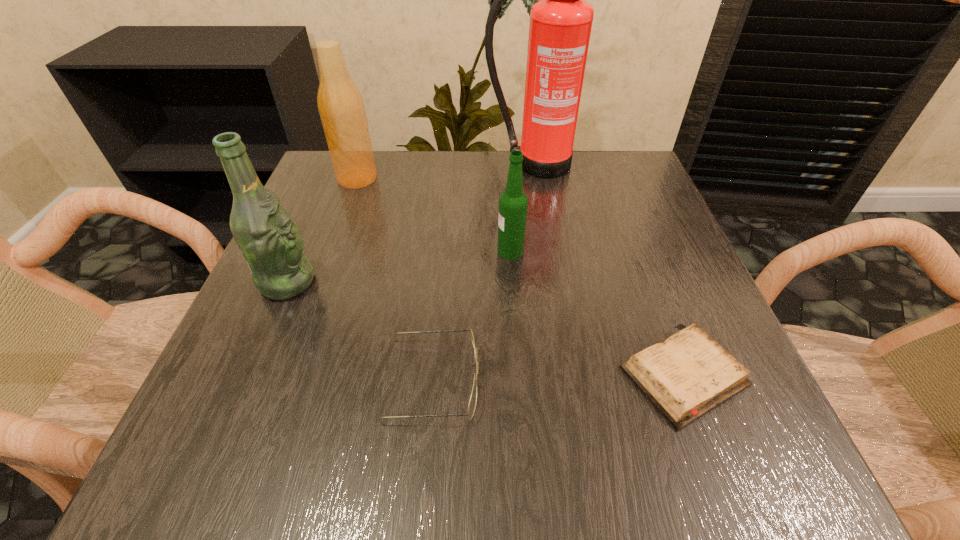
Locate an element on the screen. The width and height of the screenshot is (960, 540). fire extinguisher positioned at the right edge is located at coordinates (560, 26).

Find the location of a particular element. diary positioned at the right edge is located at coordinates (688, 374).

I want to click on object situated at the far left corner, so click(x=341, y=107).

At what (x,y) coordinates should I click in order to perform the action: click on object present at the far right corner. Please return your answer as a coordinate pair (x, y). The width and height of the screenshot is (960, 540). Looking at the image, I should click on (560, 26).

Identify the location of object that is at the near right corner. (688, 374).

Find the location of a particular element. The image size is (960, 540). vacant space at the far edge of the desktop is located at coordinates (462, 171).

Where is `free spot at the near edge of the desktop`? The image size is (960, 540). free spot at the near edge of the desktop is located at coordinates (510, 472).

This screenshot has width=960, height=540. Identify the location of vacant space at the left edge of the desktop. (301, 407).

This screenshot has height=540, width=960. In the image, there is a desktop. Find the location of `vacant space at the right edge`. vacant space at the right edge is located at coordinates (670, 293).

Where is `vacant region at the far left corner of the desktop`? This screenshot has height=540, width=960. vacant region at the far left corner of the desktop is located at coordinates (323, 181).